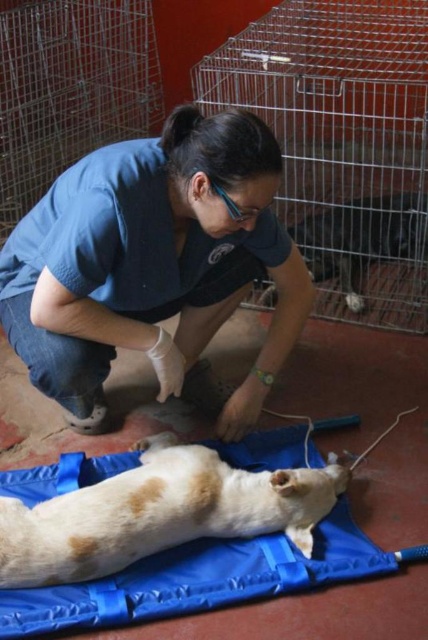
Can you confirm if blue fabric at center is bigger than light brown fur at center?

Correct, blue fabric at center is larger in size than light brown fur at center.

Which is in front, point (91, 308) or point (261, 504)?

Point (91, 308)

Describe the element at coordinates (152, 262) in the screenshot. I see `blue fabric at center` at that location.

You are a GUI agent. You are given a task and a screenshot of the screen. Output one action in this format:
    pyautogui.click(x=<x>, y=<y>)
    Task: Click on the blue fabric at center
    The image size is (428, 640).
    Given the screenshot: What is the action you would take?
    pyautogui.click(x=152, y=262)

At what (x,y) coordinates should I click in order to perform the action: click on light brown fur at center. Please return your answer as a coordinate pair (x, y). This screenshot has height=640, width=428. Looking at the image, I should click on [158, 513].

Is point (165, 518) in front of point (371, 248)?

Yes, point (165, 518) is in front of point (371, 248).

Is point (216, 488) behind point (353, 209)?

No, it is not.

This screenshot has height=640, width=428. What are the coordinates of `light brown fur at center` in the screenshot? It's located at (158, 513).

Identify the location of blue fabric at center. (152, 262).

Does blue fabric at center have a greater height compared to white fur dog at center?

Yes, blue fabric at center is taller than white fur dog at center.

Which is in front, point (127, 246) or point (327, 237)?

Point (127, 246) is more forward.

Identify the location of blue fabric at center. The width and height of the screenshot is (428, 640). (152, 262).